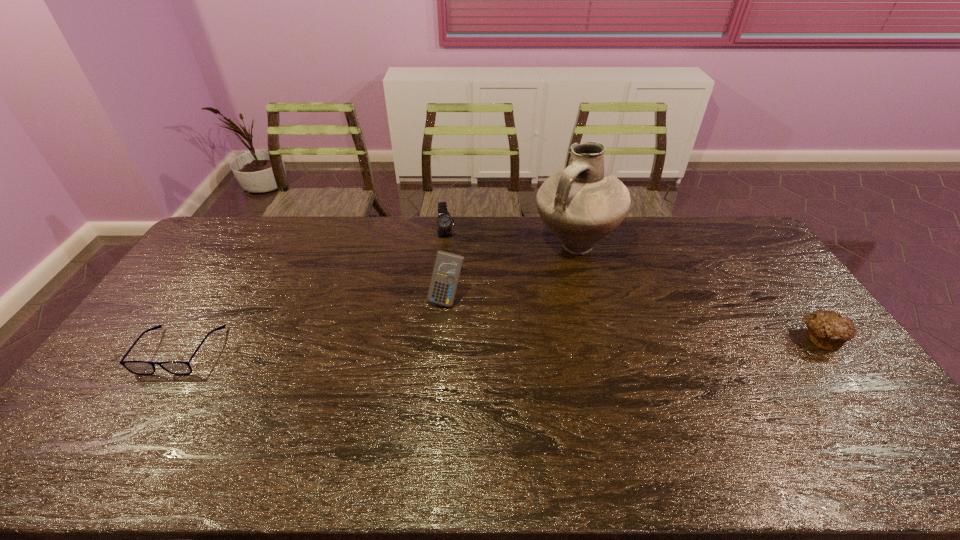
Locate an element on the screen. This screenshot has width=960, height=540. vacant space on the desktop that is between the spectacles and the rightmost object and is positioned on the handle side of the tallest object is located at coordinates (529, 343).

This screenshot has height=540, width=960. Identify the location of vacant space on the desktop that is between the shortest object and the fourth tallest object and is positioned on the face of the watch. (470, 345).

I want to click on vacant space on the desktop that is between the shortest object and the rightmost object and is positioned on the front-facing side of the third farthest object, so click(x=423, y=346).